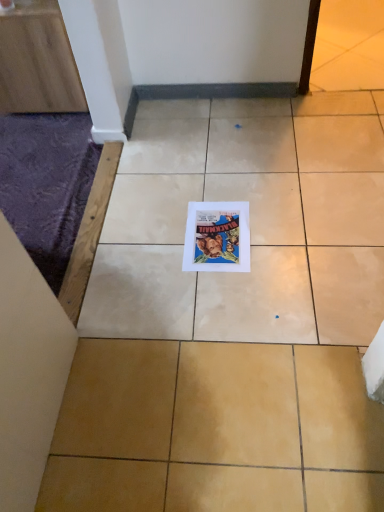
Identify the location of matte paper comic book at center. (217, 237).

The width and height of the screenshot is (384, 512). What do you see at coordinates (217, 237) in the screenshot?
I see `matte paper comic book at center` at bounding box center [217, 237].

What is the approximate width of matte paper comic book at center?

The width of matte paper comic book at center is 11.87 inches.

What are the coordinates of `matte paper comic book at center` in the screenshot? It's located at (217, 237).